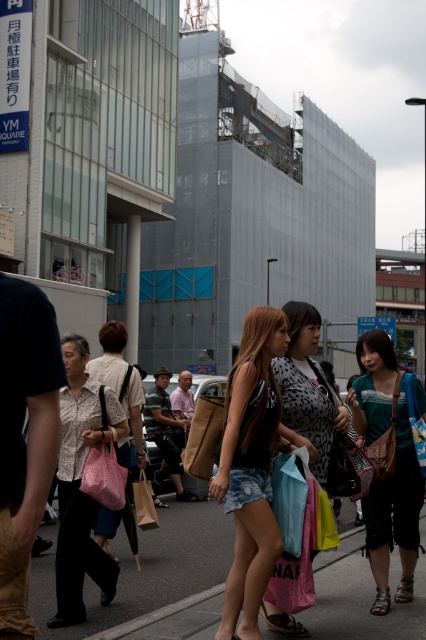
Is teal fabric top at center closer to the viewer compared to leopard print dress at center?

No, it is not.

Which is above, teal fabric top at center or leopard print dress at center?

leopard print dress at center is above.

Is point (402, 600) positioned in front of point (307, 376)?

That is False.

This screenshot has width=426, height=640. I want to click on teal fabric top at center, so click(x=385, y=465).

Is smooth asphalt pavement at lower center taller than patterned fabric shirt at center?

In fact, smooth asphalt pavement at lower center may be shorter than patterned fabric shirt at center.

Can you confirm if smooth asphalt pavement at lower center is shorter than patterned fabric shirt at center?

Yes, smooth asphalt pavement at lower center is shorter than patterned fabric shirt at center.

Describe the element at coordinates (155, 582) in the screenshot. I see `smooth asphalt pavement at lower center` at that location.

Locate an element on the screen. Image resolution: width=426 pixels, height=640 pixels. smooth asphalt pavement at lower center is located at coordinates (155, 582).

Can you confirm if matte floral blouse at lower left is shorter than matte white blouse at center?

No.

Which is more to the right, matte floral blouse at lower left or matte white blouse at center?

matte white blouse at center

Between point (77, 616) and point (138, 392), which one is positioned behind?

The point (138, 392) is behind.

Find the location of a particular element. matte floral blouse at lower left is located at coordinates (80, 483).